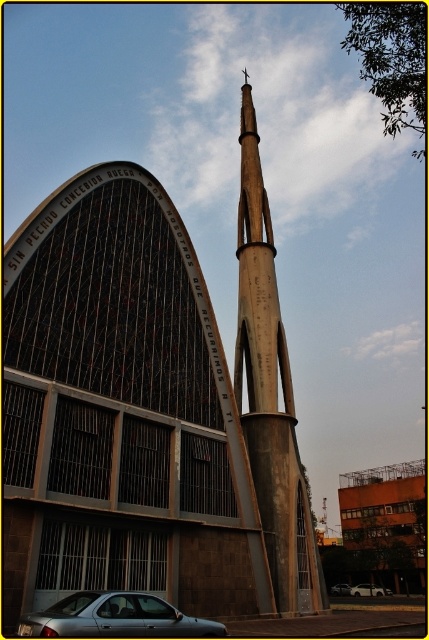
Question: Which point is closer to the camera?

Choices:
 (A) (389, 595)
 (B) (347, 516)
 (C) (72, 595)

Answer: (C)

Question: In this image, where is silver metallic car at center located relative to satin silver sedan at center?

Choices:
 (A) right
 (B) left

Answer: (A)

Question: Does concrete steeple at center appear over silver metallic car at lower left?

Choices:
 (A) yes
 (B) no

Answer: (A)

Question: Which of the following is the farthest from the observer?

Choices:
 (A) silver metallic car at center
 (B) satin silver sedan at center

Answer: (B)

Question: Is silver metallic car at lower left positioned behind silver metallic car at center?

Choices:
 (A) no
 (B) yes

Answer: (A)

Question: Which object is positioned farthest from the silver metallic car at center?

Choices:
 (A) smooth concrete spire at center
 (B) orange brick building at center
 (C) silver metallic car at lower left
 (D) satin silver sedan at center

Answer: (C)